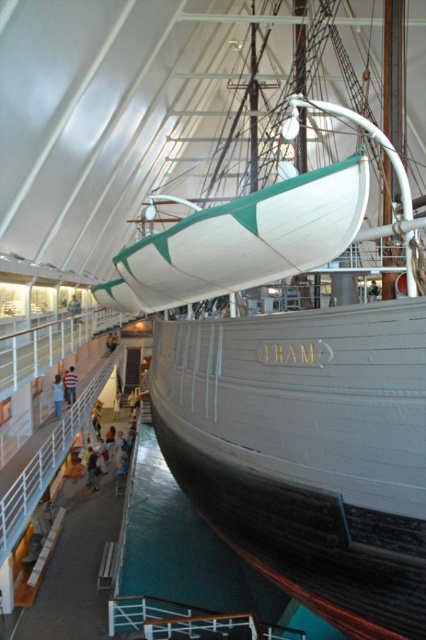
Question: Can you confirm if white shirt at center is smaller than light brown wooden person at center?

Choices:
 (A) yes
 (B) no

Answer: (B)

Question: Considering the real-world distances, which object is farthest from the light brown wooden person at center?

Choices:
 (A) white cotton shirt at center
 (B) white shirt at center

Answer: (B)

Question: Which point appears farthest from the camera in this image?

Choices:
 (A) (55, 394)
 (B) (63, 378)

Answer: (B)

Question: Is white cotton shirt at center to the left of white shirt at center from the viewer's perspective?

Choices:
 (A) yes
 (B) no

Answer: (B)

Question: Which object is the farthest from the white cotton shirt at center?

Choices:
 (A) white shirt at center
 (B) light brown wooden person at center

Answer: (B)

Question: Does white cotton shirt at center have a smaller size compared to white shirt at center?

Choices:
 (A) yes
 (B) no

Answer: (A)